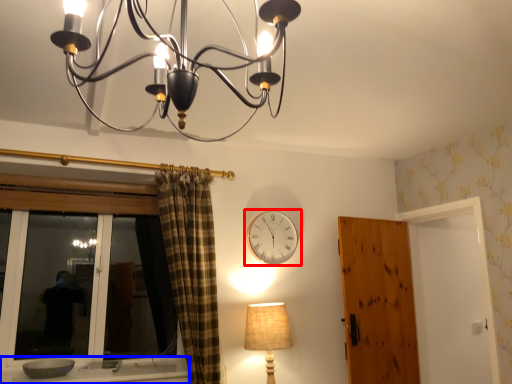
Question: Which point is closer to the camera, wall clock (highlighted by a red box) or window sill (highlighted by a blue box)?

Choices:
 (A) wall clock
 (B) window sill

Answer: (B)